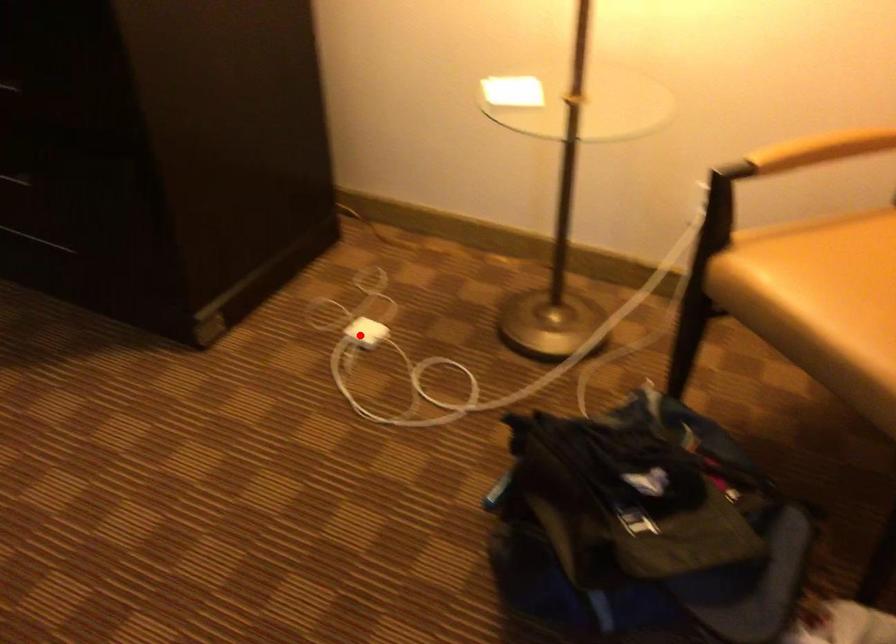
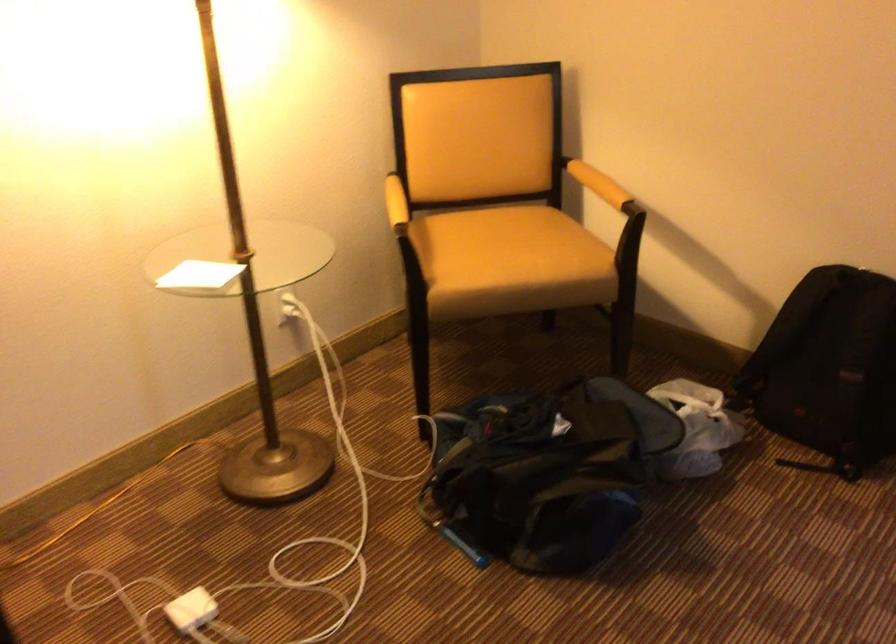
Find the pixel in the second image that matches the highlighted location in the first image.

(192, 609)